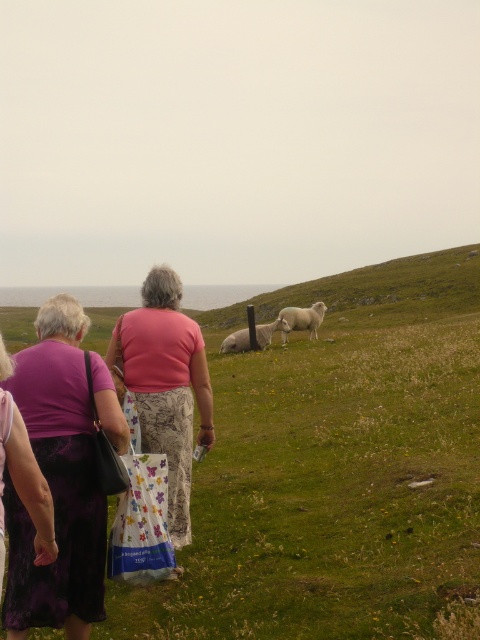
You are a photographer standing on the grassy hillside. You want to take a photo of the white fluffy sheep at center while also including the pink fabric skirt at center in the frame. Given that your camera has a maximum zoom of 10x, can you fit both subjects into the same photo without moving closer?

The pink fabric skirt at center and white fluffy sheep at center are 14.78 meters apart. Since the camera has a maximum zoom of 10x, it is possible to fit both subjects into the same photo without moving closer, as the distance between them allows for sufficient framing with the available zoom.

You are a photographer trying to capture a clear shot of the white fluffy sheep at center and the white woolly sheep at center. Since both are at the center, how can you distinguish which one is closer to you?

The white fluffy sheep at center is shorter than the white woolly sheep at center, so the white fluffy sheep at center appears closer because it is smaller in size.